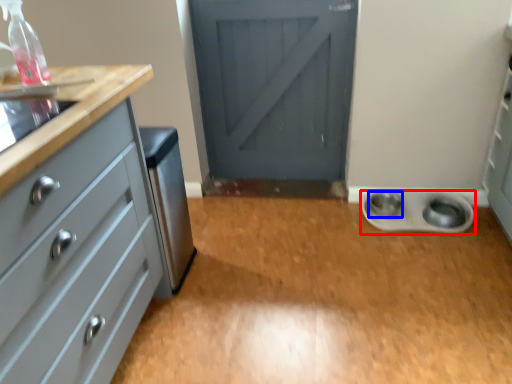
Question: Which of the following is the farthest to the observer, appliance (highlighted by a red box) or knob (highlighted by a blue box)?

Choices:
 (A) appliance
 (B) knob

Answer: (B)